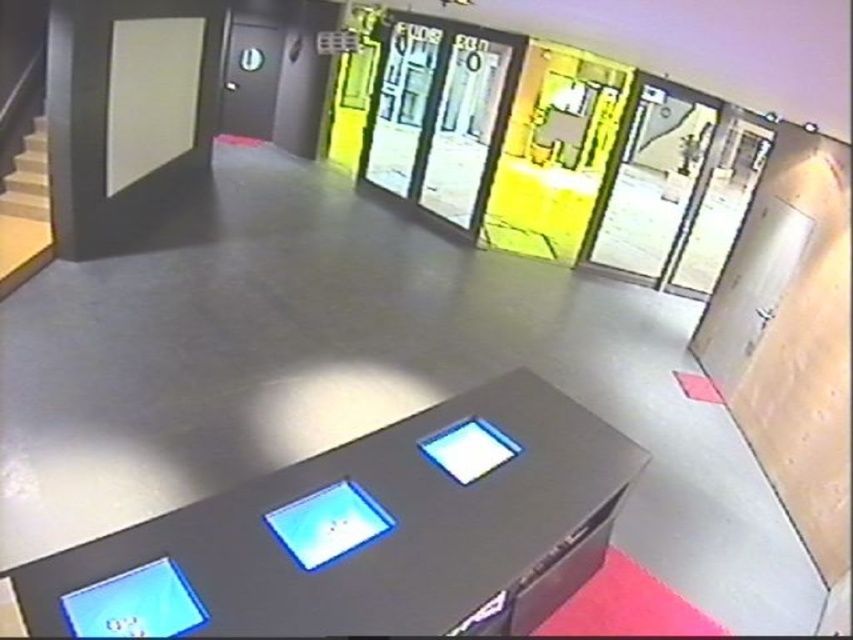
Can you confirm if metallic gray table at center is thinner than wooden stairs at left?

Incorrect, metallic gray table at center's width is not less than wooden stairs at left's.

Which is in front, point (613, 516) or point (36, 150)?

Point (613, 516) is in front.

Find the location of a particular element. metallic gray table at center is located at coordinates (366, 532).